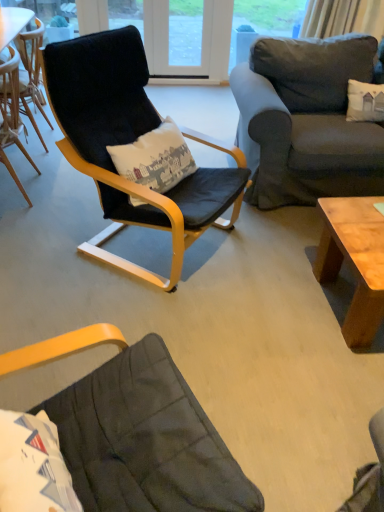
You are a GUI agent. You are given a task and a screenshot of the screen. Output one action in this format:
    pyautogui.click(x=<x>, y=<y>)
    Task: Click on the vacant space underneath velvet black armchair at center, placed as the first chair when sorted from right to left (from a real-world perspective)
    This screenshot has width=384, height=512.
    Given the screenshot: What is the action you would take?
    pyautogui.click(x=155, y=247)